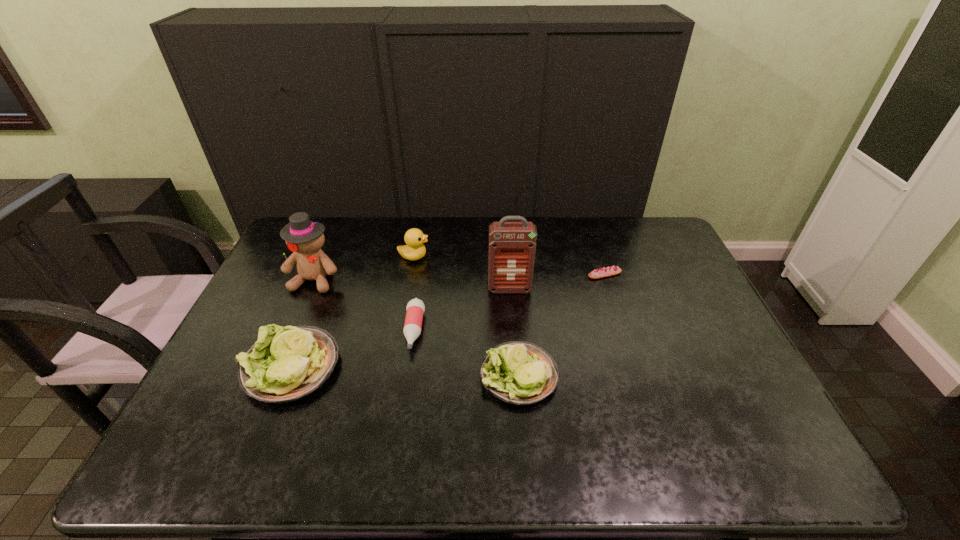
Identify the location of bottle. This screenshot has width=960, height=540. (415, 308).

Identify the location of free region located on the back of the fourth tallest object. (328, 272).

Identify the location of free space located 0.310m on the right of the right lettuce. The height and width of the screenshot is (540, 960). (678, 375).

Image resolution: width=960 pixels, height=540 pixels. What are the coordinates of `vacant region located on the face of the fifth shortest object` in the screenshot? It's located at (520, 256).

Locate an element on the screen. This screenshot has height=540, width=960. vacant area situated on the front-facing side of the first-aid kit is located at coordinates (514, 347).

At what (x,y) coordinates should I click in order to perform the action: click on free region located on the left of the shortest object. Please return your answer as a coordinate pair (x, y). This screenshot has height=540, width=960. Looking at the image, I should click on (557, 274).

Locate an element on the screen. The height and width of the screenshot is (540, 960). free space located on the front-facing side of the rag_doll is located at coordinates (289, 339).

Locate an element on the screen. vacant space positioned with the cap open on the bottle is located at coordinates (400, 422).

Find the location of a particular element. object located at the far edge is located at coordinates (414, 238).

This screenshot has height=540, width=960. Identify the location of lettuce located in the left edge section of the desktop. [284, 365].